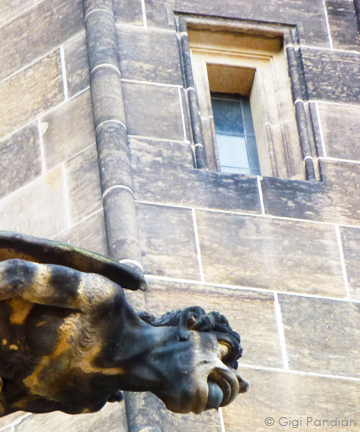
The width and height of the screenshot is (360, 432). What are the coordinates of `glass` in the screenshot? It's located at (239, 116).